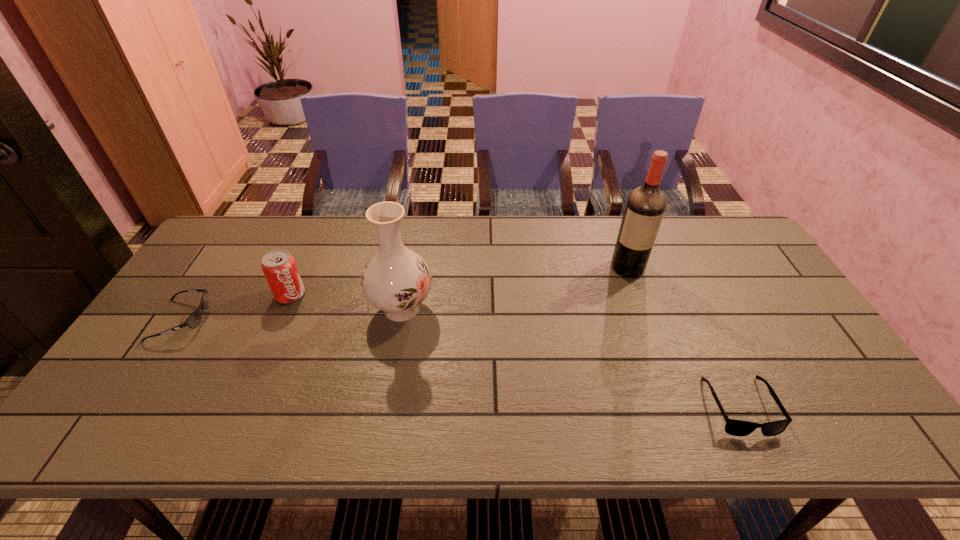
In the image, there is a desktop. Where is `vacant region at the right edge`? The image size is (960, 540). vacant region at the right edge is located at coordinates (792, 388).

Identify the location of free space between the left sunglasses and the rightmost object. Image resolution: width=960 pixels, height=540 pixels. (461, 363).

Locate an element on the screen. empty space that is in between the vase and the fourth object from right to left is located at coordinates (346, 301).

Identify the location of free space between the liquor and the fourth object from right to left. The width and height of the screenshot is (960, 540). (459, 281).

The height and width of the screenshot is (540, 960). Find the location of `free space that is in between the tallest object and the fourth object from right to left`. free space that is in between the tallest object and the fourth object from right to left is located at coordinates (459, 281).

Image resolution: width=960 pixels, height=540 pixels. I want to click on vacant space that's between the right sunglasses and the fourth object from right to left, so click(x=515, y=350).

The image size is (960, 540). Identify the location of empty location between the leftmost object and the nearest object. (461, 363).

Find the location of a particular element. vacant point located between the third tallest object and the rightmost object is located at coordinates [515, 350].

What are the coordinates of `vacant space that is in between the third tallest object and the second object from right to left` in the screenshot? It's located at (459, 281).

Select which object appears as the second closest to the nearest object. Please provide its 2D coordinates. Your answer should be formatted as a tuple, i.e. [(x, y)], where the tuple contains the x and y coordinates of a point satisfying the conditions above.

[(396, 280)]